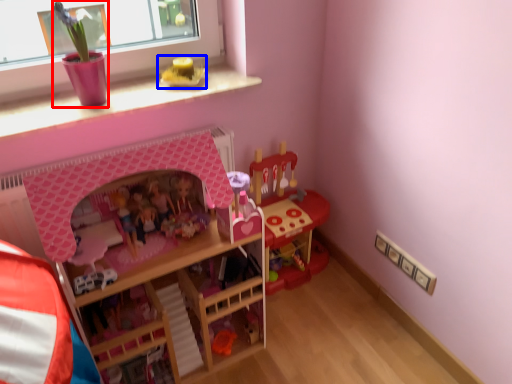
Question: Which of the following is the farthest to the observer, toy (highlighted by a red box) or toy (highlighted by a blue box)?

Choices:
 (A) toy
 (B) toy

Answer: (B)